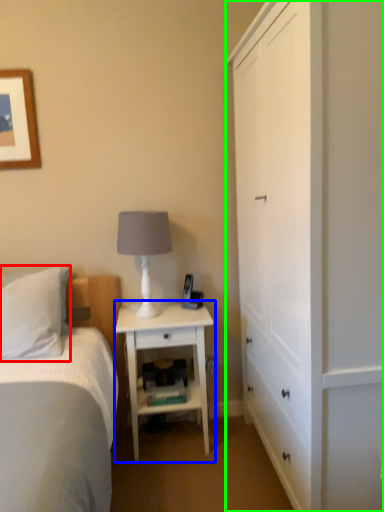
Question: Which is farther away from pillow (highlighted by a red box)? nightstand (highlighted by a blue box) or cabinetry (highlighted by a green box)?

Choices:
 (A) nightstand
 (B) cabinetry

Answer: (B)